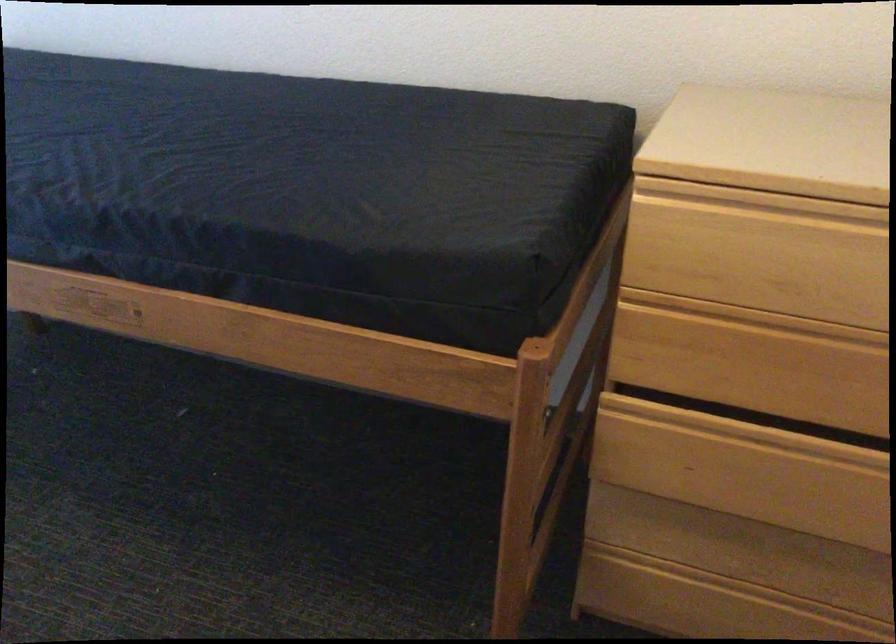
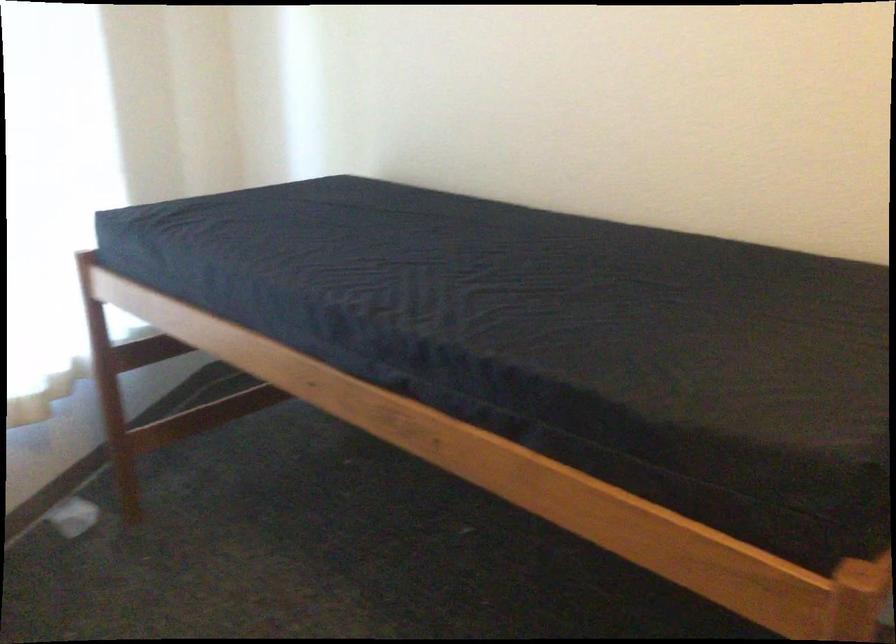
Find the pixel in the second image that matches (135,162) in the first image.

(460, 297)